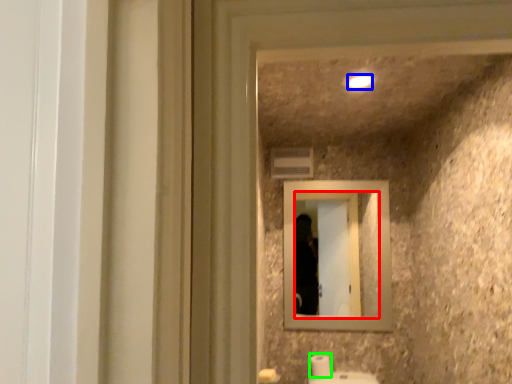
Question: Which object is the closest to the mirror (highlighted by a red box)? Choose among these: light (highlighted by a blue box) or toilet paper (highlighted by a green box).

Choices:
 (A) light
 (B) toilet paper

Answer: (B)